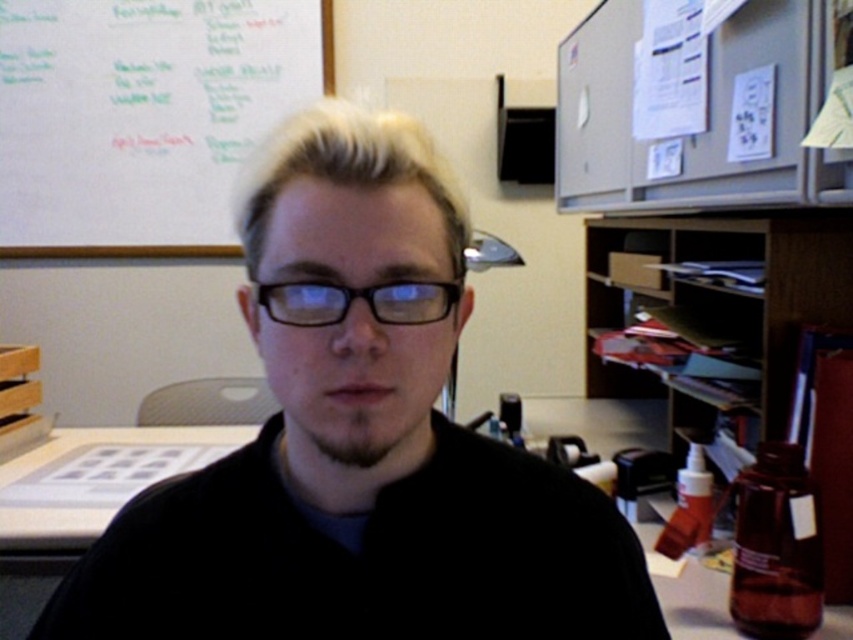
You are a new employee in the office and need to locate the whiteboard at upper left and the black plastic glasses at center. From your perspective, which object is higher up in the image?

The whiteboard at upper left is taller than black plastic glasses at center, so the whiteboard at upper left is higher up in the image.

You are a drone operator trying to navigate between two points in the image. The first point is point (x=416, y=182) and the second point is point (x=67, y=86). Which point is closer to the camera?

Point (x=416, y=182) is closer to the camera than point (x=67, y=86).

You are standing in the office scene and want to reach the whiteboard at upper left. What is the nearest object to your current position at point (143, 116)?

The nearest object to point (143, 116) is the whiteboard at upper left, as it is located exactly at that coordinate.